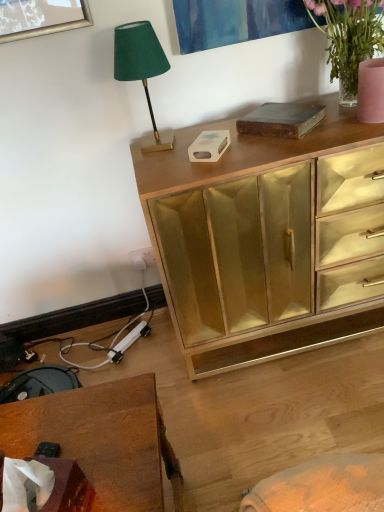
Question: From a real-world perspective, is green velvet lampshade at upper left positioned above or below wooden desk at lower left?

Choices:
 (A) above
 (B) below

Answer: (A)

Question: Based on their positions, is green velvet lampshade at upper left located to the left or right of wooden desk at lower left?

Choices:
 (A) right
 (B) left

Answer: (A)

Question: Considering the real-world distances, which object is closest to the wooden desk at lower left?

Choices:
 (A) translucent glass vase at upper right
 (B) gold mirrored cabinet at upper center
 (C) green velvet lampshade at upper left

Answer: (B)

Question: Which object is the farthest from the translucent glass vase at upper right?

Choices:
 (A) green velvet lampshade at upper left
 (B) wooden desk at lower left
 (C) gold mirrored cabinet at upper center

Answer: (B)